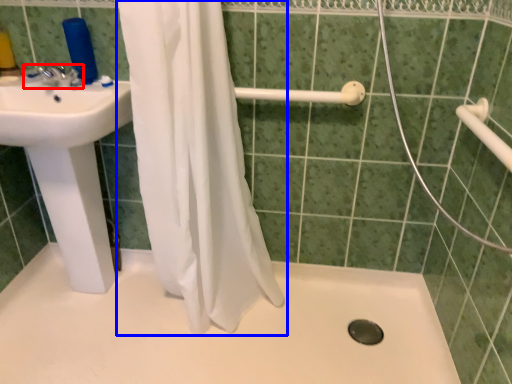
Question: Which object is closer to the camera taking this photo, tap (highlighted by a red box) or curtain (highlighted by a blue box)?

Choices:
 (A) tap
 (B) curtain

Answer: (B)